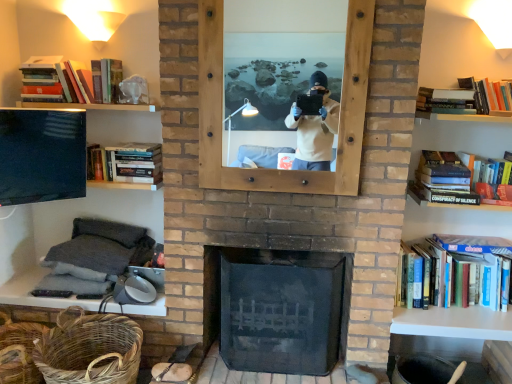
Where is `free space above dark gray fabric at lower left (from a real-world perspective)`? free space above dark gray fabric at lower left (from a real-world perspective) is located at coordinates (97, 239).